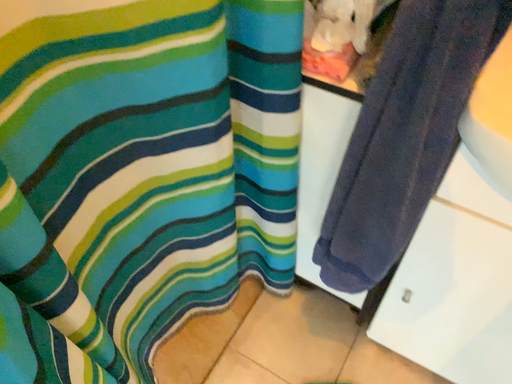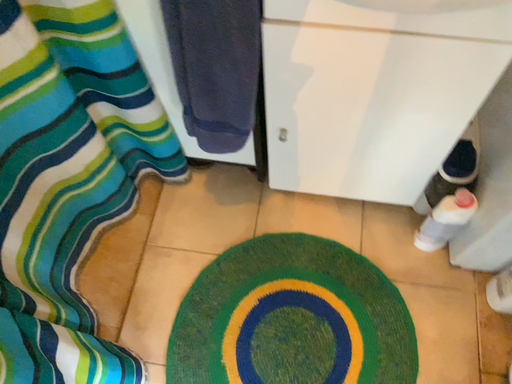
Question: Which way did the camera rotate in the video?

Choices:
 (A) rotated left
 (B) rotated right

Answer: (B)